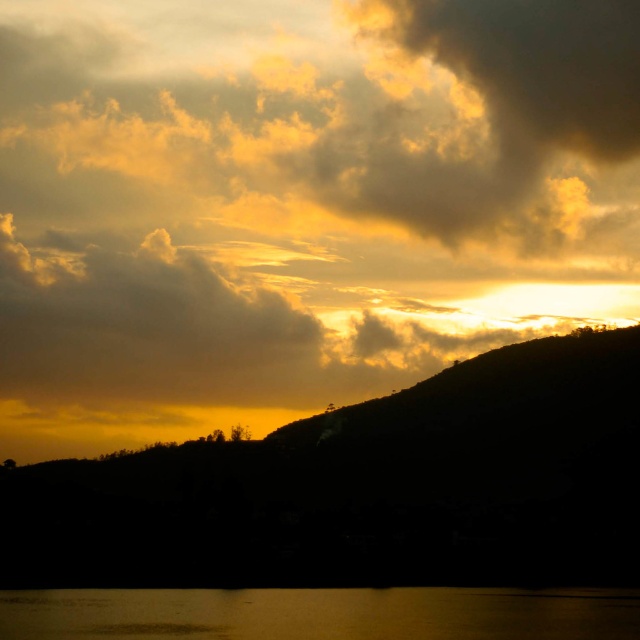
Question: Is golden matte cloud at upper center above silhouette mountain at center?

Choices:
 (A) no
 (B) yes

Answer: (B)

Question: Considering the relative positions of silhouette mountain at center and silvery reflective water at lower center in the image provided, where is silhouette mountain at center located with respect to silvery reflective water at lower center?

Choices:
 (A) above
 (B) below

Answer: (A)

Question: Which object appears farthest from the camera in this image?

Choices:
 (A) silvery reflective water at lower center
 (B) silhouette mountain at center

Answer: (B)

Question: Among these points, which one is nearest to the camera?

Choices:
 (A) (362, 35)
 (B) (372, 502)
 (C) (35, 608)

Answer: (B)

Question: Among these points, which one is farthest from the camera?

Choices:
 (A) (486, 602)
 (B) (570, 8)

Answer: (B)

Question: Does golden matte cloud at upper center come behind silvery reflective water at lower center?

Choices:
 (A) yes
 (B) no

Answer: (A)